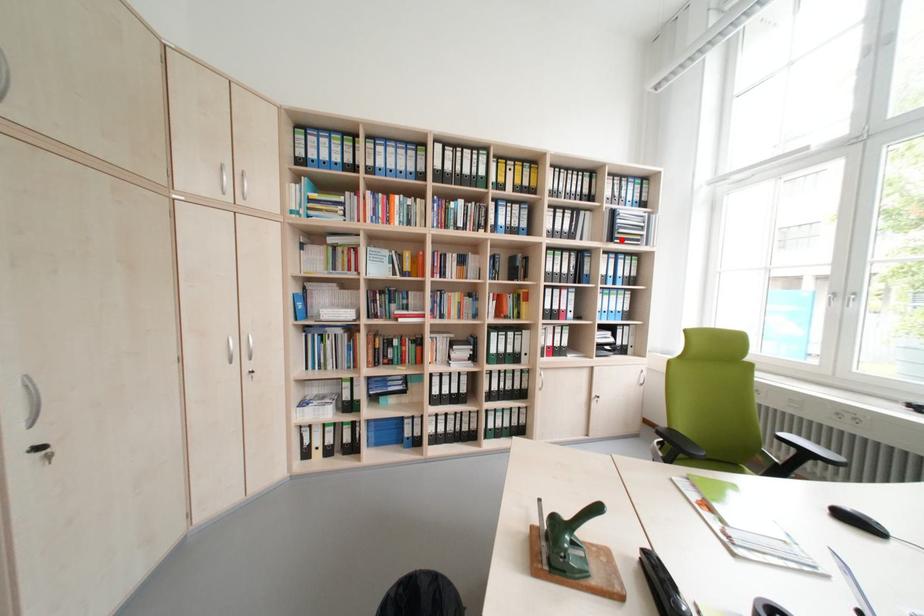
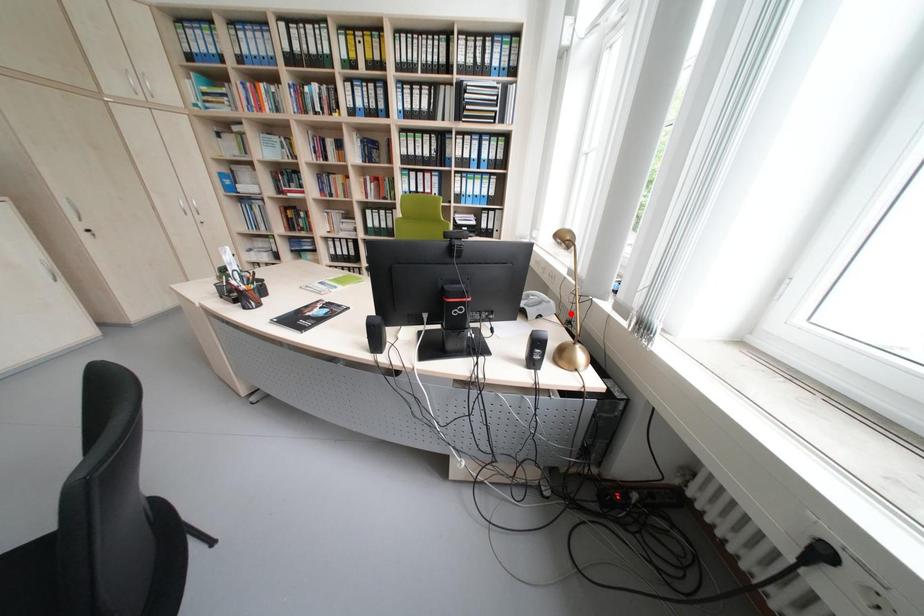
Based on the photo, I am providing you with two images of the same scene from different viewpoints. A red point is marked on the first image and another point is marked on the second image. Are the points marked in image1 and image2 representing the same 3D position?

No